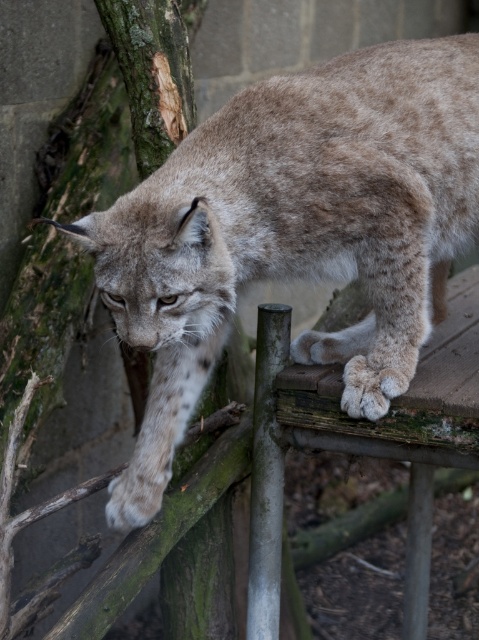
Question: Where is fuzzy brown fur at upper center located in relation to green rough bark at left in the image?

Choices:
 (A) right
 (B) left

Answer: (A)

Question: Can you confirm if fuzzy brown fur at upper center is smaller than green rough bark at left?

Choices:
 (A) no
 (B) yes

Answer: (A)

Question: Which point is farther to the camera?

Choices:
 (A) green rough bark at left
 (B) fuzzy brown fur at upper center

Answer: (A)

Question: Which point is farther to the camera?

Choices:
 (A) (307, 273)
 (B) (101, 77)

Answer: (B)

Question: Is fuzzy brown fur at upper center smaller than green rough bark at left?

Choices:
 (A) no
 (B) yes

Answer: (A)